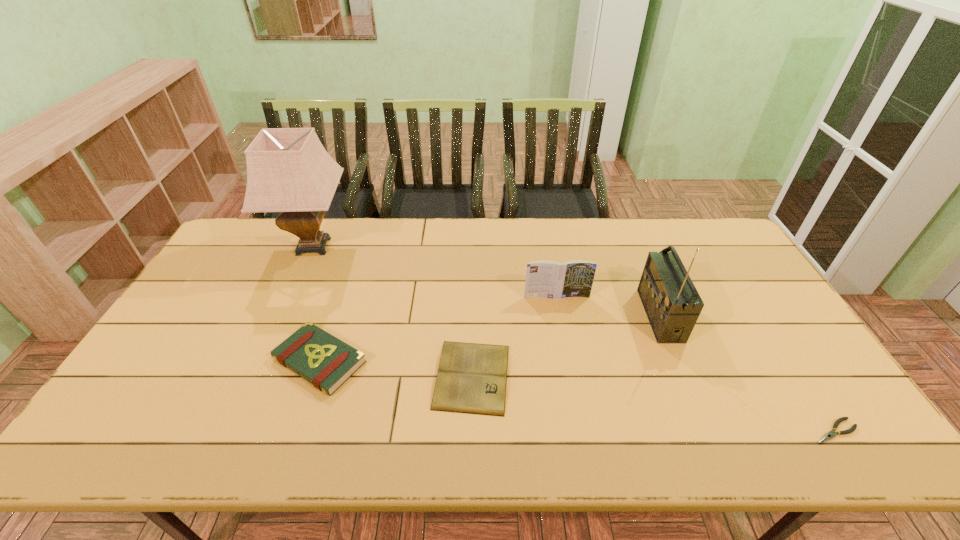
Identify the location of object that is at the far edge. (289, 171).

The height and width of the screenshot is (540, 960). Identify the location of object that is at the near edge. coord(828,436).

This screenshot has height=540, width=960. What are the coordinates of `object that is at the right edge` in the screenshot? It's located at (828, 436).

The image size is (960, 540). Identify the location of object located at the near right corner. (828, 436).

The width and height of the screenshot is (960, 540). I want to click on blank area at the far edge, so click(643, 230).

This screenshot has width=960, height=540. I want to click on free space at the near edge of the desktop, so click(x=212, y=428).

At what (x,y) coordinates should I click in order to perform the action: click on vacant space at the left edge. Please return your answer as a coordinate pair (x, y). Looking at the image, I should click on (178, 389).

Locate an element on the screen. This screenshot has height=540, width=960. vacant point at the right edge is located at coordinates (738, 335).

Locate an element on the screen. vacant space at the near left corner is located at coordinates (96, 456).

Where is `vacant space in between the pliers and the tallest object`? vacant space in between the pliers and the tallest object is located at coordinates (574, 339).